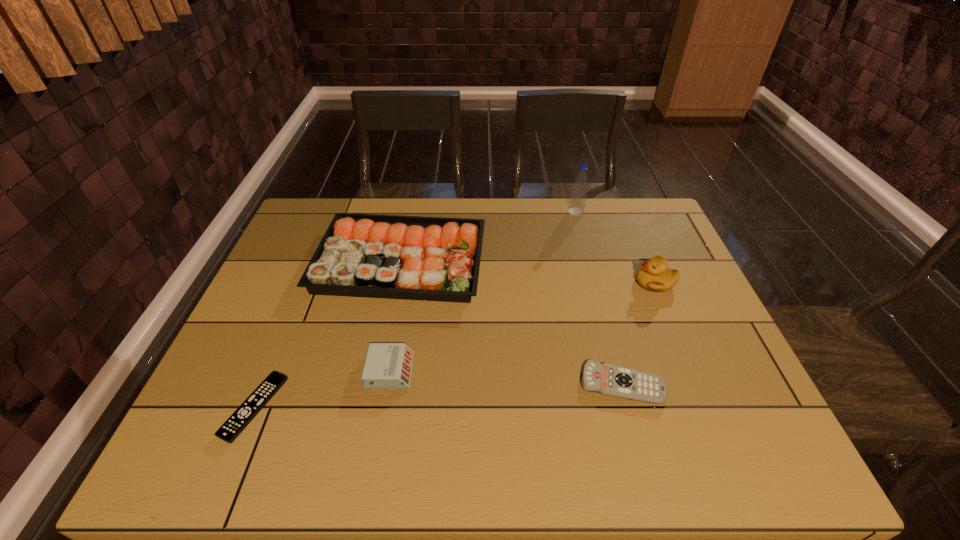
Where is `unoccupied position between the second shortest object and the water bottle`? unoccupied position between the second shortest object and the water bottle is located at coordinates (599, 298).

Identify the location of unoccupied position between the third tallest object and the third shortest object. The image size is (960, 540). (395, 315).

The height and width of the screenshot is (540, 960). Identify the location of object that can be found as the closest to the third shortest object. (360, 255).

Find the location of a particular element. object that is the second closest to the alarm clock is located at coordinates (237, 422).

The width and height of the screenshot is (960, 540). What are the coordinates of `vacant point that satisfies the following two spatial constraints: 1. on the front-facing side of the fifth shortest object; 2. on the front side of the shortest object` in the screenshot? It's located at (708, 408).